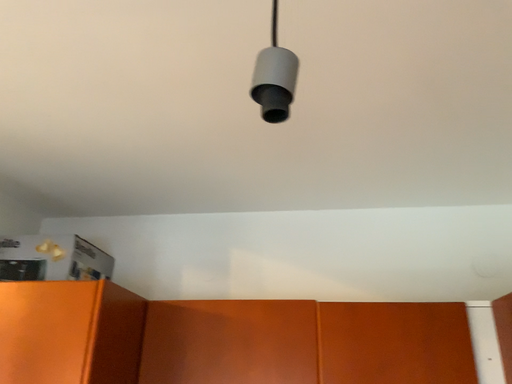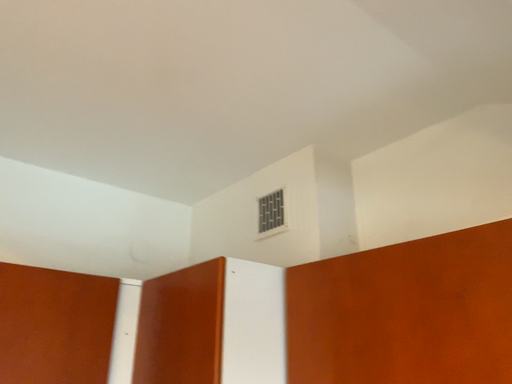
Question: Which way did the camera rotate in the video?

Choices:
 (A) rotated downward
 (B) rotated upward

Answer: (A)